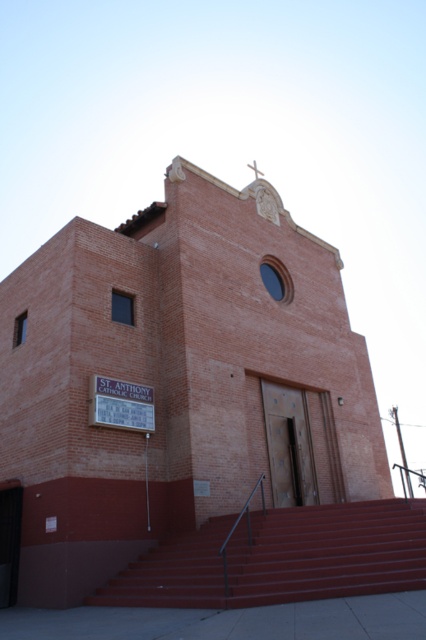
You are standing at the entrance of the brick church at center and want to see the maroon painted stairs at center from your current position. Are the stairs visible from where you are standing?

The brick church at center is larger in size compared to the maroon painted stairs at center, but since both are at the center, the stairs should be visible unless obstructed by the church structure. However, the description does not mention any obstruction, so yes, the maroon painted stairs at center are visible from the entrance of the brick church at center.

Looking at this image, you are standing at the entrance of the brick church at center and want to see the maroon painted stairs at center. Which direction should you face to see them?

→ The maroon painted stairs at center is behind the brick church at center, so you should turn around and face the back of the brick church at center to see them.

You are standing in front of St. Anthony Catholic Church. Where is the brick church at center located in the image?

The brick church at center is located at the center of the image, as indicated by its 2D coordinates at point (176, 380).